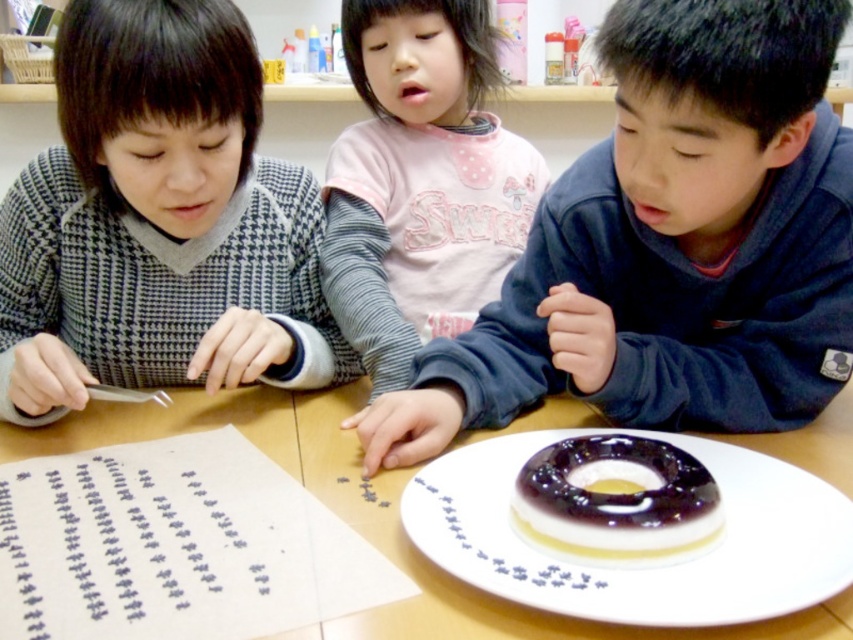
Question: Which point appears farthest from the camera in this image?

Choices:
 (A) (538, 493)
 (B) (485, 52)

Answer: (B)

Question: Can you confirm if matte blue sweater at center is positioned below gray houndstooth sweater at left?

Choices:
 (A) yes
 (B) no

Answer: (A)

Question: Is matte blue sweater at center wider than gray houndstooth sweater at left?

Choices:
 (A) no
 (B) yes

Answer: (B)

Question: Which object is positioned farthest from the matte blue sweater at center?

Choices:
 (A) black paper with blue ink at lower left
 (B) pink cotton shirt at center
 (C) translucent jelly ring at center

Answer: (A)

Question: Which of these objects is positioned closest to the black paper with blue ink at lower left?

Choices:
 (A) gray houndstooth sweater at left
 (B) pink cotton shirt at center
 (C) translucent jelly ring at center
 (D) wooden table at center

Answer: (D)

Question: Does gray houndstooth sweater at left have a larger size compared to pink cotton shirt at center?

Choices:
 (A) yes
 (B) no

Answer: (B)